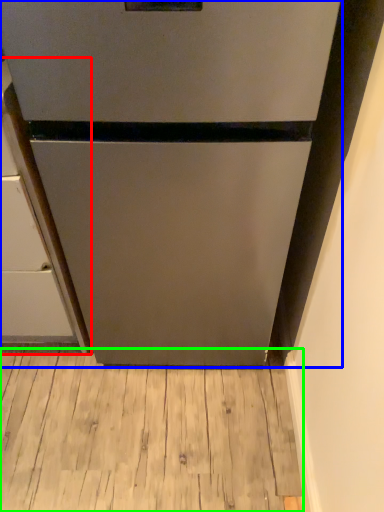
Question: Which object is positioned closest to cabinetry (highlighted by a red box)? Select from refrigerator (highlighted by a blue box) and hardwood (highlighted by a green box).

Choices:
 (A) refrigerator
 (B) hardwood

Answer: (A)